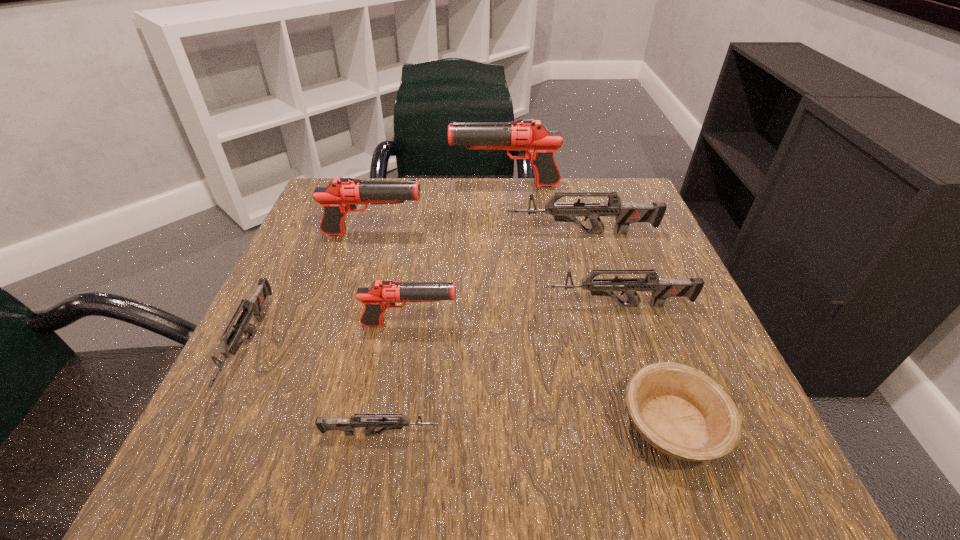
Image resolution: width=960 pixels, height=540 pixels. Identify the location of the farthest object. pos(534,140).

Where is `the biggest black gun`? The height and width of the screenshot is (540, 960). the biggest black gun is located at coordinates [x=534, y=140].

You are a GUI agent. You are given a task and a screenshot of the screen. Output one action in this format:
    pyautogui.click(x=<x>, y=<y>)
    Task: Click on the second farthest black gun
    
    Given the screenshot: What is the action you would take?
    pyautogui.click(x=341, y=195)

This screenshot has height=540, width=960. In order to click on the second smallest black gun in this screenshot , I will do `click(341, 195)`.

Identify the location of the nearest black gun. (381, 294).

This screenshot has width=960, height=540. In order to click on the farthest grey gun in this screenshot , I will do `click(626, 213)`.

Locate an element on the screen. the fourth shortest object is located at coordinates (661, 288).

In order to click on the third smallest grey gun in this screenshot , I will do `click(661, 288)`.

This screenshot has width=960, height=540. Find the location of `the sixth tallest object`. the sixth tallest object is located at coordinates (253, 306).

Identify the location of the leftmost gun. (253, 306).